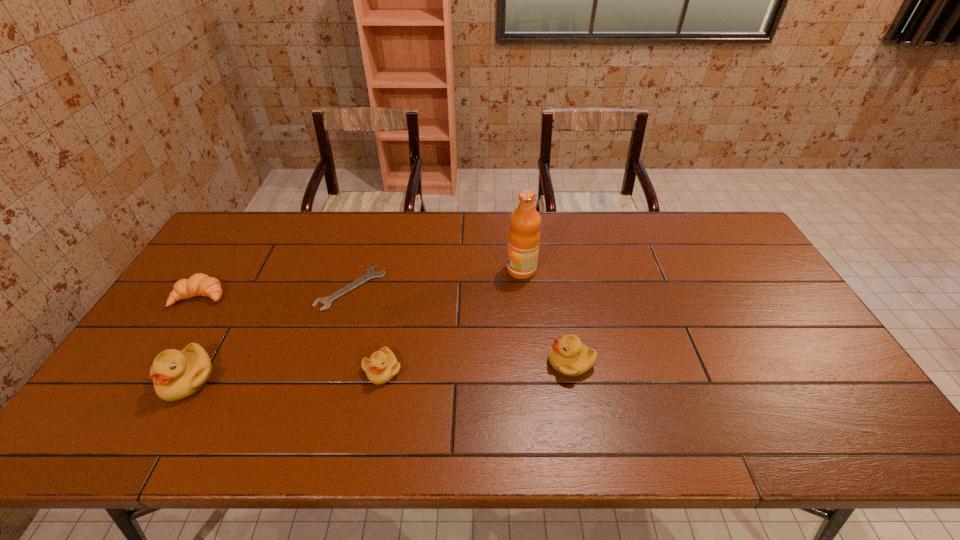
Image resolution: width=960 pixels, height=540 pixels. What are the coordinates of `the tallest duckling` in the screenshot? It's located at (176, 375).

This screenshot has height=540, width=960. Find the location of `the leftmost duckling`. the leftmost duckling is located at coordinates (176, 375).

In order to click on the second duckling from right to left in this screenshot , I will do `click(382, 366)`.

Image resolution: width=960 pixels, height=540 pixels. In order to click on the shortest duckling in this screenshot , I will do `click(382, 366)`.

Where is `the third tallest object`? The height and width of the screenshot is (540, 960). the third tallest object is located at coordinates (568, 356).

Image resolution: width=960 pixels, height=540 pixels. In order to click on the second shortest duckling in this screenshot , I will do `click(568, 356)`.

This screenshot has height=540, width=960. Find the location of `the tallest object`. the tallest object is located at coordinates (524, 237).

The image size is (960, 540). Find the location of `the shortest object`. the shortest object is located at coordinates (370, 274).

The height and width of the screenshot is (540, 960). What are the coordinates of `the second shortest object` in the screenshot? It's located at [x=199, y=284].

Locate an element on the screen. The width and height of the screenshot is (960, 540). vacant space located on the front-facing side of the rightmost duckling is located at coordinates (505, 362).